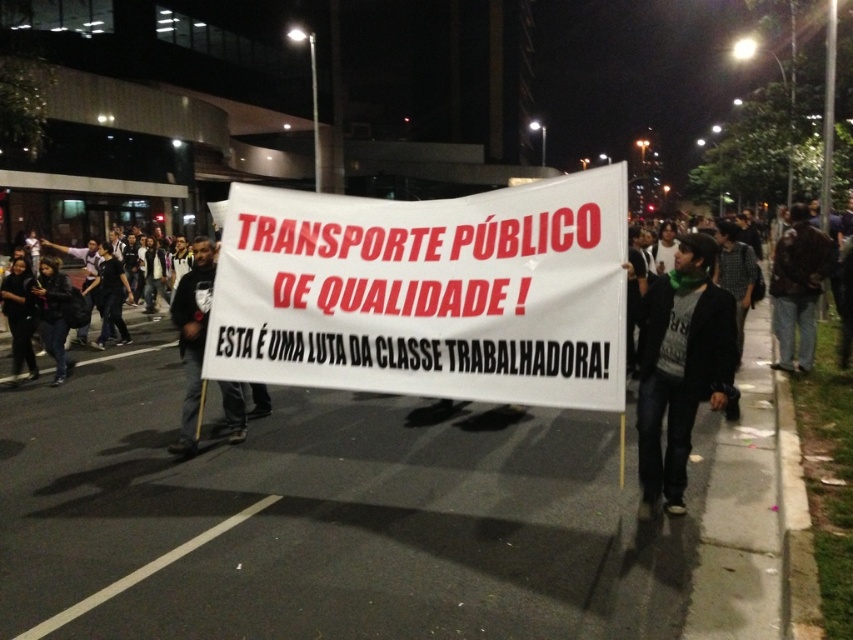
You are a photographer trying to capture the protest banner clearly. You notice the white paper banner at center and the dark brown leather jacket at right in your frame. Which object is shorter in height?

The white paper banner at center is shorter in height compared to the dark brown leather jacket at right.

From the picture: You are a photographer trying to capture the protest scene. You notice two individuals wearing jackets. The first is wearing a black leather jacket at left and the second a dark brown leather jacket at right. Based on their jacket sizes, which person do you think is closer to the camera?

The black leather jacket at left occupies less space than the dark brown leather jacket at right, so the person wearing the dark brown leather jacket at right is closer to the camera because larger objects in the frame typically indicate closer proximity.